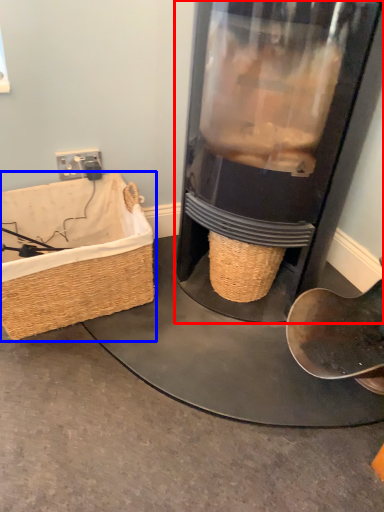
Question: Which object appears closest to the camera in this image, appliance (highlighted by a red box) or picnic basket (highlighted by a blue box)?

Choices:
 (A) appliance
 (B) picnic basket

Answer: (A)